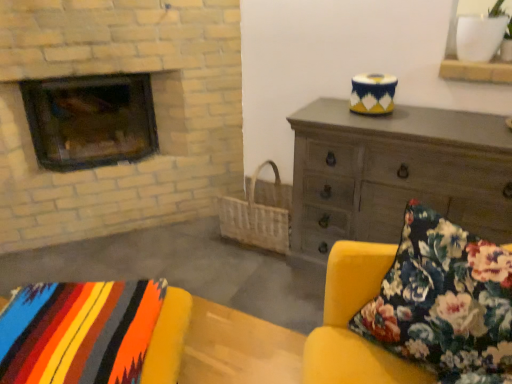
Question: Looking at their shapes, would you say dark brown wood burning stove at left is wider or thinner than floral fabric cushion at lower right?

Choices:
 (A) wide
 (B) thin

Answer: (A)

Question: Is dark brown wood burning stove at left to the left or to the right of floral fabric cushion at lower right in the image?

Choices:
 (A) right
 (B) left

Answer: (B)

Question: Considering the real-world distances, which object is farthest from the floral fabric cushion at lower right?

Choices:
 (A) dark gray wooden chest of drawers at upper right
 (B) dark brown wood burning stove at left
 (C) multicolored woven blanket at lower left

Answer: (B)

Question: Which object is the closest to the dark gray wooden chest of drawers at upper right?

Choices:
 (A) multicolored woven blanket at lower left
 (B) floral fabric cushion at lower right
 (C) dark brown wood burning stove at left

Answer: (B)